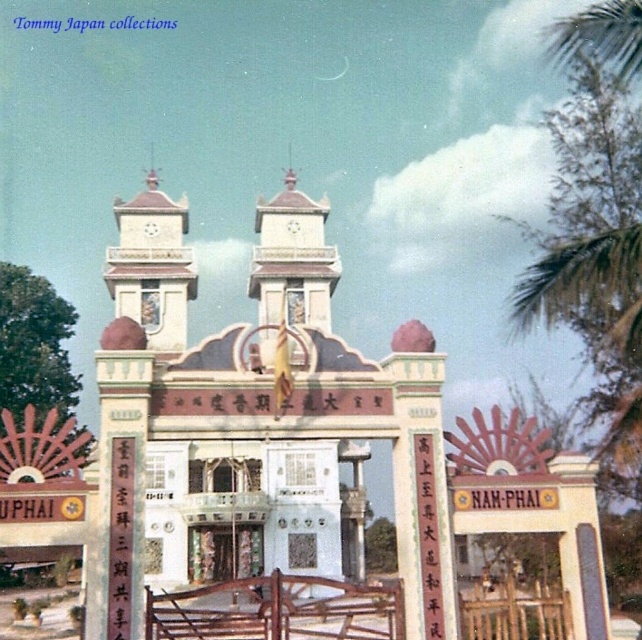
Does point (114, 202) lie behind point (272, 301)?

Yes, point (114, 202) is farther from viewer.

Can you confirm if white stone clock tower at upper center is positioned below white stone tower at center?

Incorrect, white stone clock tower at upper center is not positioned below white stone tower at center.

Does point (169, 288) lie in front of point (284, 205)?

Yes.

The height and width of the screenshot is (640, 642). Identify the location of white stone clock tower at upper center. (152, 266).